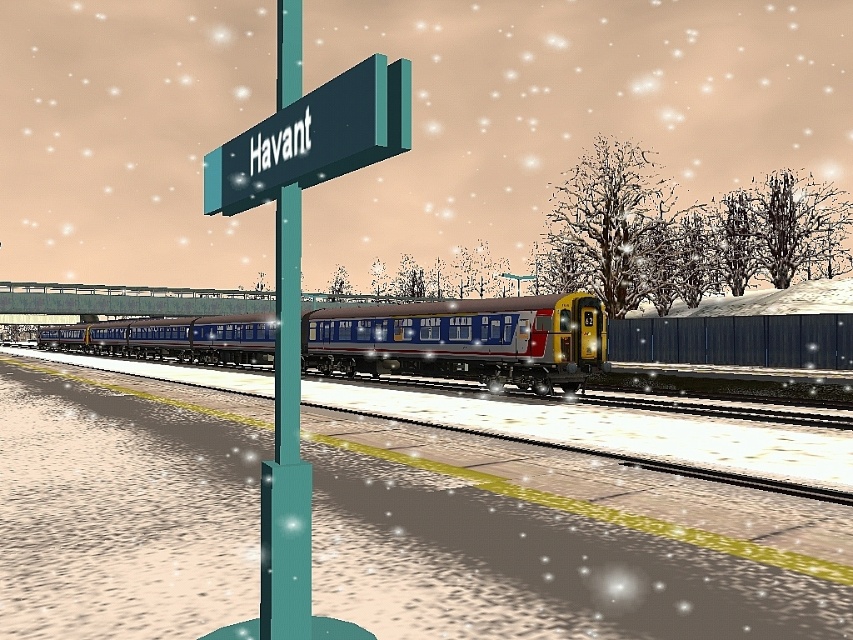
You are a traveler at the snowy railway station. You need to read the teal glossy signpost at center and the green matte signboard at upper center. Which one do you think is smaller in size?

The teal glossy signpost at center has a smaller size compared to the green matte signboard at upper center, so the teal glossy signpost at center is smaller.

You are a passenger waiting at the Havant station. You notice the metallic blue train at center and the teal glossy signpost at center. Which object is wider from your perspective?

The metallic blue train at center might be wider than teal glossy signpost at center, so the metallic blue train at center is likely wider.